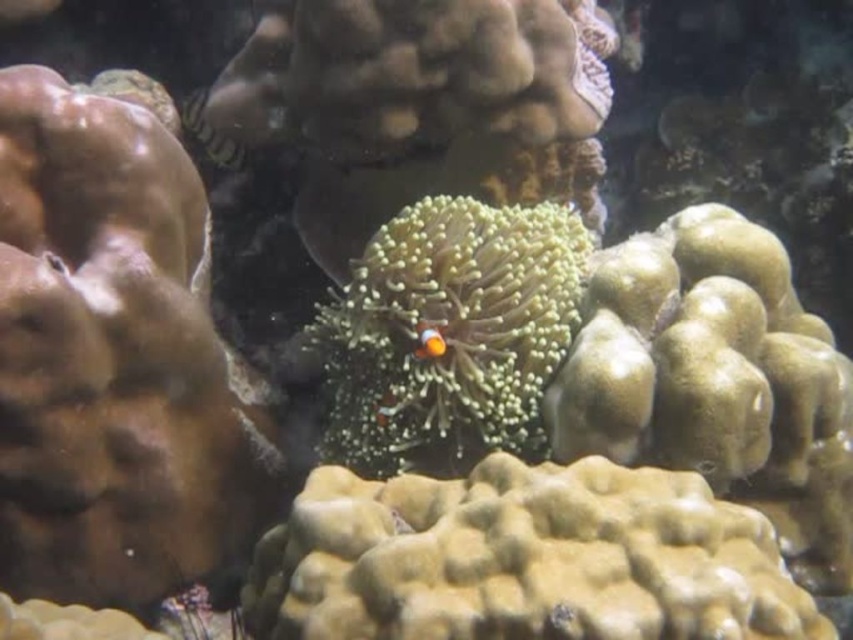
You are an underwater photographer aiming to capture a closeup of both the green fuzzy coral at center and the shiny green fish at upper left in one frame. Given the distance between them, will you need to adjust your camera lens to a wider angle to include both subjects?

The green fuzzy coral at center is 23.40 inches away from the shiny green fish at upper left. To capture both in one frame, you would need to use a wider angle lens to accommodate the distance between them.

You are a marine biologist observing an underwater scene in an aquarium. You notice a shiny green fish at upper left and a bright orange clownfish at center. Based on their positions, which fish could potentially block the sunlight from reaching the other?

The shiny green fish at upper left could potentially block sunlight from reaching the bright orange clownfish at center because it is positioned above it.